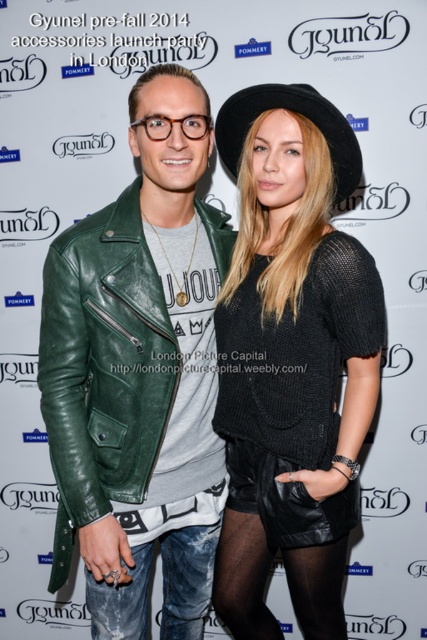
Who is more distant from viewer, (181, 580) or (348, 172)?

The point (181, 580) is behind.

Which is in front, point (208, 556) or point (318, 125)?

Positioned in front is point (318, 125).

Which is in front, point (172, 625) or point (239, 115)?

Point (239, 115)

At what (x,y) coordinates should I click in order to perform the action: click on denim jeans at lower left. Please return your answer as a coordinate pair (x, y). The height and width of the screenshot is (640, 427). Looking at the image, I should click on (187, 579).

Does point (198, 212) come closer to viewer compared to point (236, 148)?

That is True.

Does green leather jacket at left have a greater width compared to black felt hat at upper center?

Yes, green leather jacket at left is wider than black felt hat at upper center.

Does point (114, 221) lie in front of point (351, 188)?

Yes.

Where is `green leather jacket at left`? Image resolution: width=427 pixels, height=640 pixels. green leather jacket at left is located at coordinates (102, 368).

In the scene shown: Who is more distant from viewer, (260, 292) or (73, 497)?

Positioned behind is point (260, 292).

Based on the photo, between black knitted sweater at center and green leather jacket at left, which one has less height?

green leather jacket at left

Is point (294, 211) closer to camera compared to point (63, 545)?

That is False.

The image size is (427, 640). I want to click on black knitted sweater at center, so click(x=292, y=358).